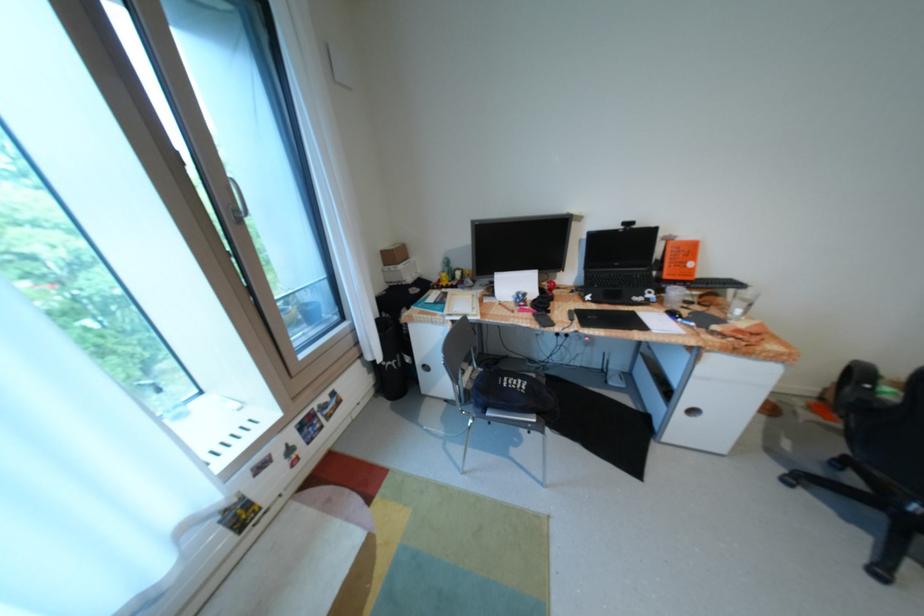
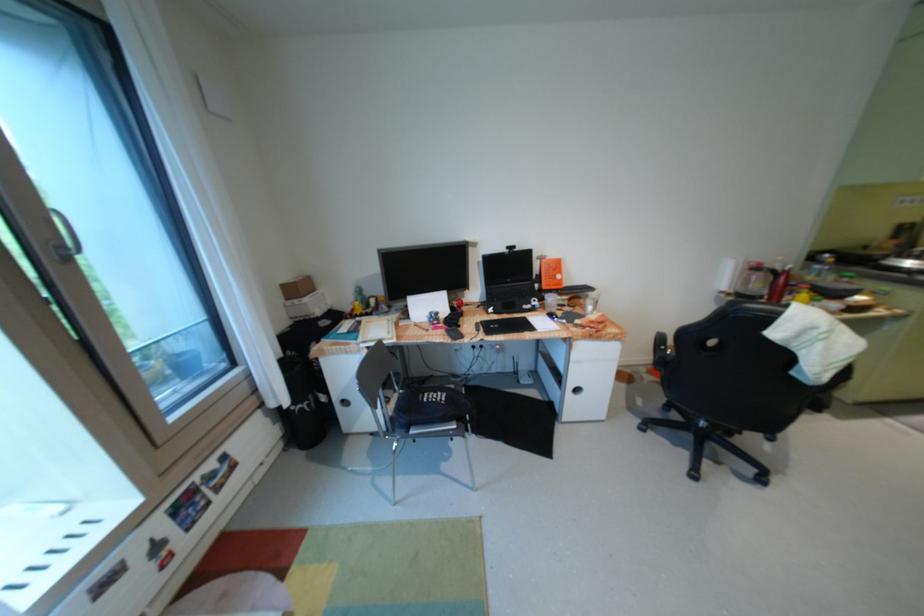
What movement of the cameraman would produce the second image?

The cameraman moved toward right, backward.